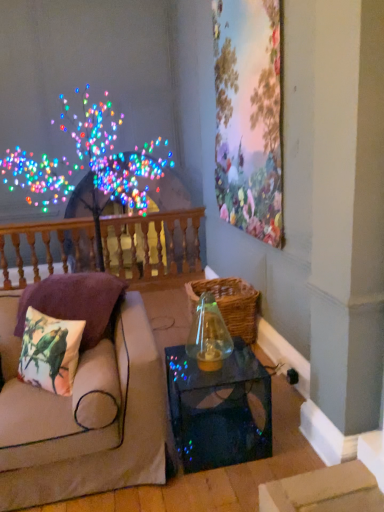
Question: Is printed fabric cushion with parrots at left, the first pillow when ordered from front to back, inside the boundaries of transparent glass vase at center, or outside?

Choices:
 (A) outside
 (B) inside

Answer: (A)

Question: Looking at the image, does printed fabric cushion with parrots at left, the first pillow when ordered from front to back, seem bigger or smaller compared to transparent glass vase at center?

Choices:
 (A) big
 (B) small

Answer: (B)

Question: Estimate the real-world distances between objects in this image. Which object is farther from the floral wallpaper at upper right?

Choices:
 (A) printed fabric cushion with parrots at left, arranged as the 2th pillow when viewed from the back
 (B) woven brown basket at center
 (C) transparent glass vase at center
 (D) printed fabric cushion at left, placed as the 1th pillow when sorted from back to front
 (E) transparent glass table at lower center

Answer: (A)

Question: Considering the real-world distances, which object is closest to the transparent glass vase at center?

Choices:
 (A) beige fabric couch at left
 (B) wooden balustrade at upper left
 (C) woven brown basket at center
 (D) printed fabric cushion at left, which is the 2th pillow in front-to-back order
 (E) transparent glass table at lower center

Answer: (E)